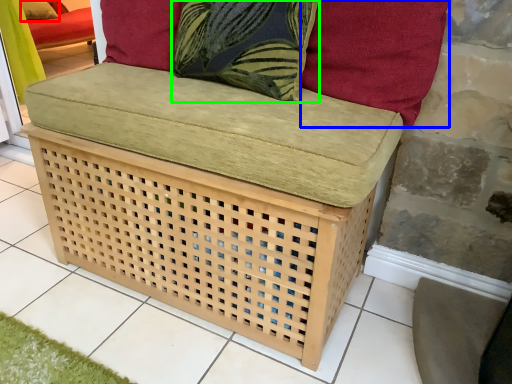
Question: Considering the real-world distances, which object is farthest from pillow (highlighted by a red box)? pillow (highlighted by a blue box) or throw pillow (highlighted by a green box)?

Choices:
 (A) pillow
 (B) throw pillow

Answer: (A)